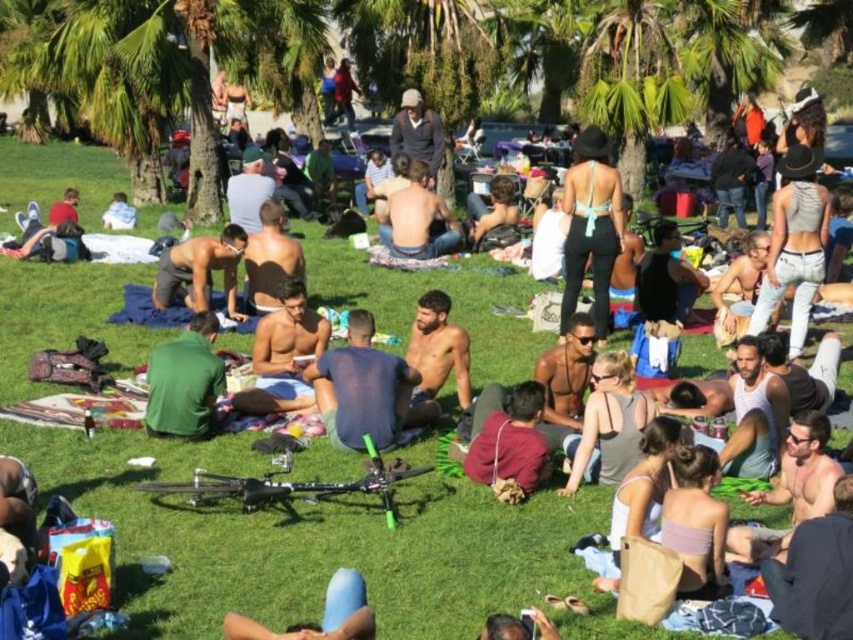
Looking at this image, you are standing at the point labeled point (262,284) and want to walk to the point labeled point (103,227). Which direction should you move in to get closer to your destination?

You should move towards the direction away from the camera because point (103,227) is further away from the camera than point (262,284).